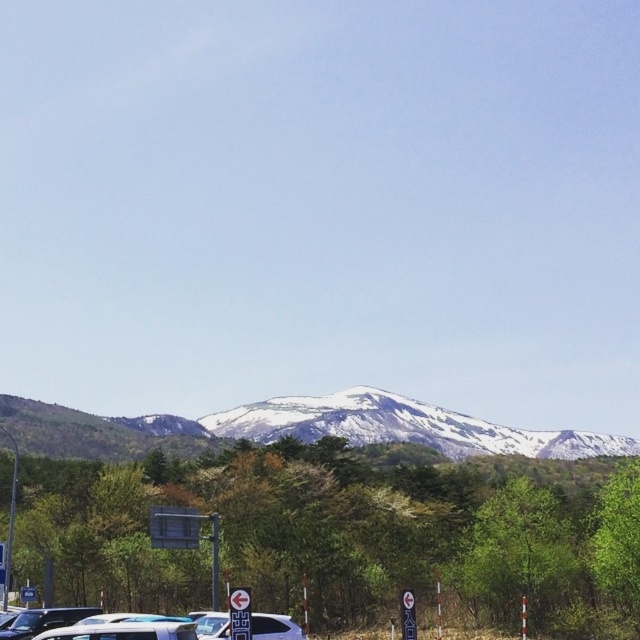
Question: Estimate the real-world distances between objects in this image. Which object is closer to the green leafy park at lower center?

Choices:
 (A) metallic silver car at lower left
 (B) sleek silver sedan at lower center
 (C) metallic silver car at lower center
 (D) snowy white mountain at center

Answer: (A)

Question: Does metallic silver car at lower center have a greater width compared to sleek silver sedan at lower center?

Choices:
 (A) yes
 (B) no

Answer: (A)

Question: Which object is positioned farthest from the snowy white mountain at center?

Choices:
 (A) metallic silver car at lower left
 (B) metallic silver car at lower center
 (C) green leafy park at lower center

Answer: (B)

Question: Among these objects, which one is farthest from the camera?

Choices:
 (A) green leafy park at lower center
 (B) snowy white mountain at center

Answer: (B)

Question: Is green leafy park at lower center bigger than metallic silver car at lower center?

Choices:
 (A) no
 (B) yes

Answer: (B)

Question: Does sleek silver sedan at lower center appear on the right side of metallic silver car at lower left?

Choices:
 (A) no
 (B) yes

Answer: (B)